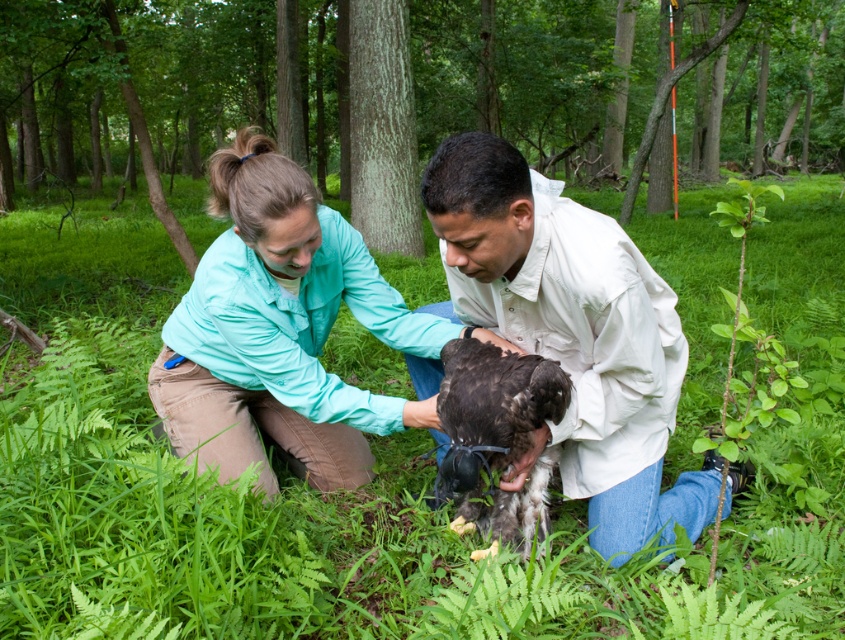
You are a bird in the forest scene. You want to land on the teal fabric shirt at center. Is the point at coordinates (281, 330) on the teal fabric shirt at center a suitable spot to land?

Yes, the point at coordinates (281, 330) is on the teal fabric shirt at center, so it is a suitable spot to land.

You are a hiker who needs to place a 1.2 meter long first aid kit between the green leafy grass at center and the white matte shirt at center. Is there enough space?

The distance between the green leafy grass at center and the white matte shirt at center is 1.52 meters. Since the first aid kit is 1.2 meters long, there is sufficient space to place it between them.

You are a hiker in the forest and need to place a small first aid kit between the two points, point (352, 616) and point (331, 467). Which point should the first aid kit be closer to if you want it to be closer to the front of the scene?

The first aid kit should be closer to point (352, 616) because it is in front of point (331, 467).